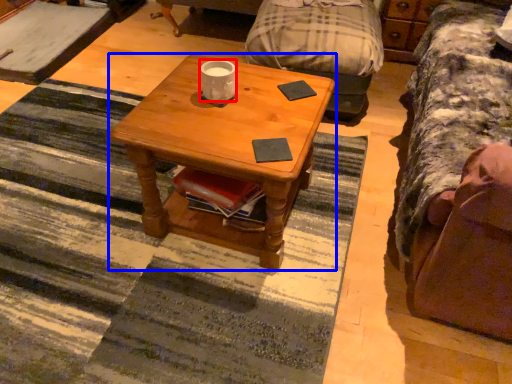
Question: Which of the following is the farthest to the observer, coffee cup (highlighted by a red box) or coffee table (highlighted by a blue box)?

Choices:
 (A) coffee cup
 (B) coffee table

Answer: (A)